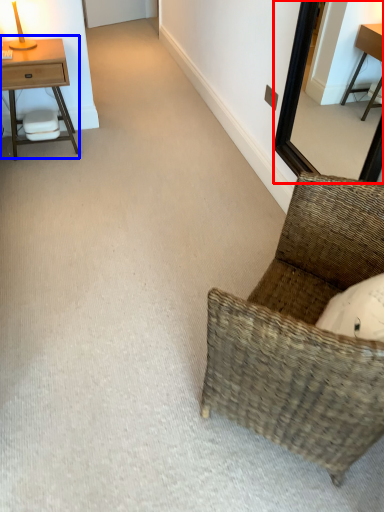
Question: Which object appears farthest to the camera in this image, mirror (highlighted by a red box) or nightstand (highlighted by a blue box)?

Choices:
 (A) mirror
 (B) nightstand

Answer: (B)